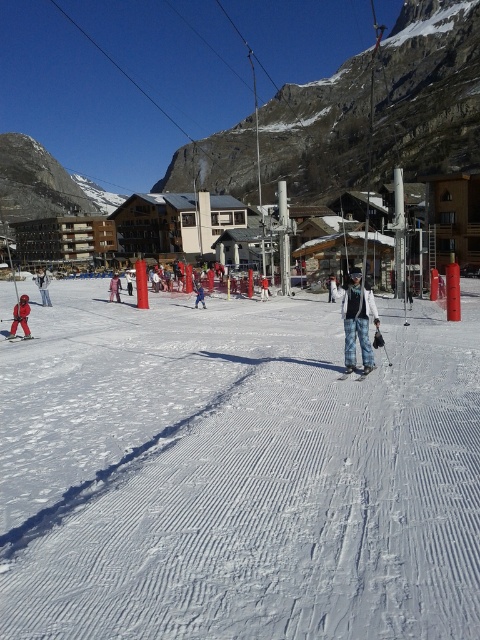
You are planning to ski down the slope and want to avoid the red fabric jacket at lower left and the metallic blue ski at center. What is the minimum distance you need to maintain between yourself and these two objects to stay safe?

The minimum distance you need to maintain between yourself and the red fabric jacket at lower left and the metallic blue ski at center is 25.23 meters, as that is the distance between them.

Based on the photo, you are a photographer wanting to capture the scene from a lower viewpoint. Based on the image, which object would appear closer to the camera between the white textured snow at center and the pink fabric pants at center?

The pink fabric pants at center would appear closer to the camera because it has a greater height than the white textured snow at center.

You are a photographer trying to capture a shot of the white textured snow at center and the matte black jacket at center. Which object should you focus on first if you want to ensure both are in frame without moving the camera?

The white textured snow at center has a smaller size compared to matte black jacket at center, so you should focus on the matte black jacket at center first to ensure both fit in the frame.